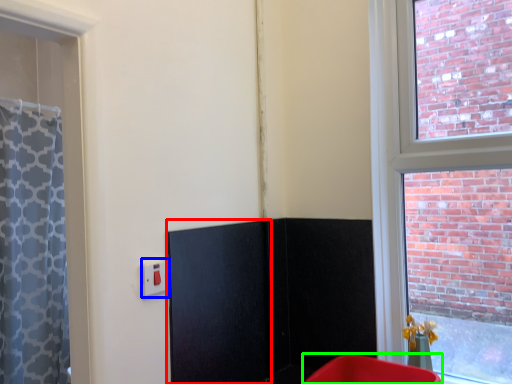
Question: Estimate the real-world distances between objects in this image. Which object is closer to screen door (highlighted by a red box), electric outlet (highlighted by a blue box) or furniture (highlighted by a green box)?

Choices:
 (A) electric outlet
 (B) furniture

Answer: (A)